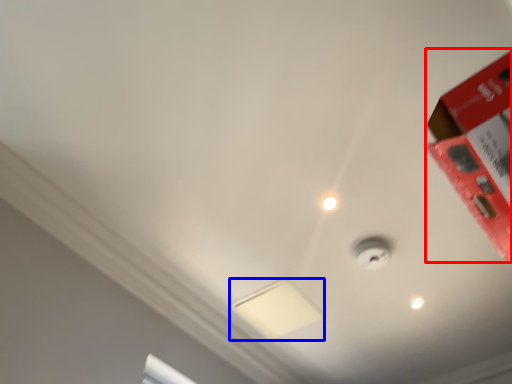
Question: Which object is closer to the camera taking this photo, box (highlighted by a red box) or lamp (highlighted by a blue box)?

Choices:
 (A) box
 (B) lamp

Answer: (A)